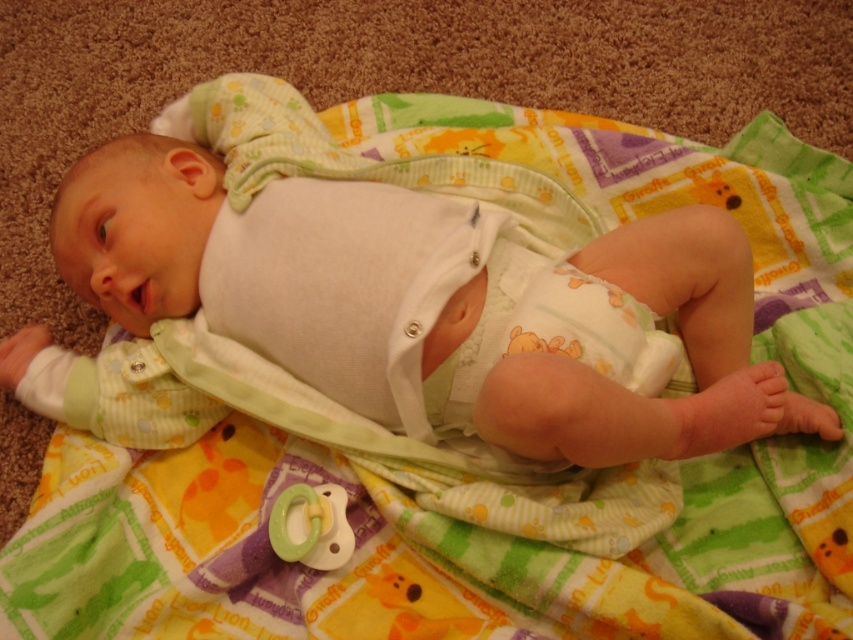
Question: Which object is the closest to the white soft diaper at center?

Choices:
 (A) green rubber pacifier at center
 (B) white cotton baby at center

Answer: (B)

Question: Which object appears farthest from the camera in this image?

Choices:
 (A) green rubber pacifier at center
 (B) white soft diaper at center
 (C) white cotton baby at center

Answer: (A)

Question: Is white cotton baby at center smaller than white soft diaper at center?

Choices:
 (A) no
 (B) yes

Answer: (A)

Question: Which of the following is the farthest from the observer?

Choices:
 (A) white cotton baby at center
 (B) white soft diaper at center

Answer: (B)

Question: Is white cotton baby at center above green rubber pacifier at center?

Choices:
 (A) yes
 (B) no

Answer: (A)

Question: Is white soft diaper at center above green rubber pacifier at center?

Choices:
 (A) no
 (B) yes

Answer: (B)